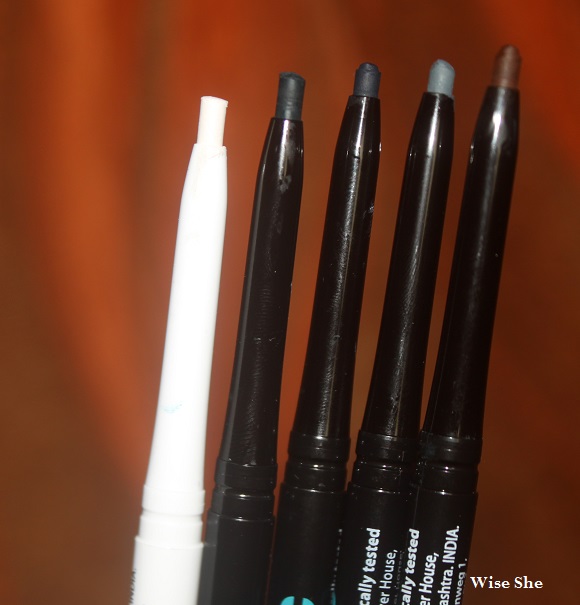
Where is `leftmost pencil`? This screenshot has height=605, width=580. leftmost pencil is located at coordinates (188, 308).